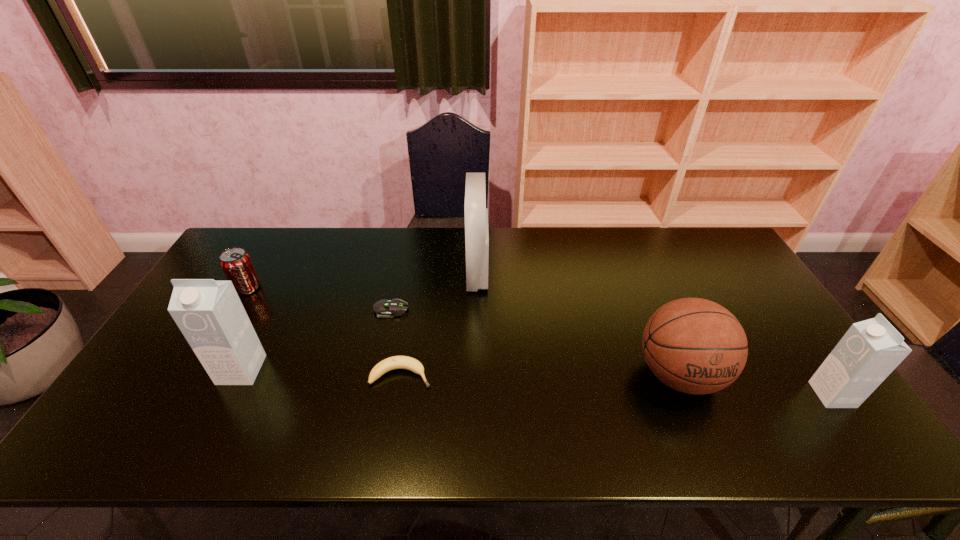
I want to click on vacant area at the far right corner, so click(x=716, y=246).

Find the location of a particular element. The width and height of the screenshot is (960, 540). free space between the shorter carton and the second object from left to right is located at coordinates (537, 382).

Identify the location of free space that is in between the second object from right to left and the shortest object. (535, 342).

Where is `vacant space that is in between the rightmost object and the third shortest object`? The image size is (960, 540). vacant space that is in between the rightmost object and the third shortest object is located at coordinates (540, 341).

You are a GUI agent. You are given a task and a screenshot of the screen. Output one action in this format:
    pyautogui.click(x=<x>, y=<y>)
    Task: Click on the blank region between the sixth object from left to right and the first-aid kit
    
    Given the screenshot: What is the action you would take?
    pyautogui.click(x=578, y=324)

Locate an element on the screen. empty space between the shortest object and the left carton is located at coordinates (316, 340).

This screenshot has width=960, height=540. In order to click on vacant region between the banana and the first-aid kit in this screenshot , I will do `click(439, 325)`.

Where is `free space between the right carton and the taller carton`? free space between the right carton and the taller carton is located at coordinates (537, 382).

This screenshot has width=960, height=540. I want to click on free space between the leftmost object and the second shortest object, so click(324, 332).

I want to click on free space between the fifth object from left to right and the second shortest object, so click(x=439, y=325).